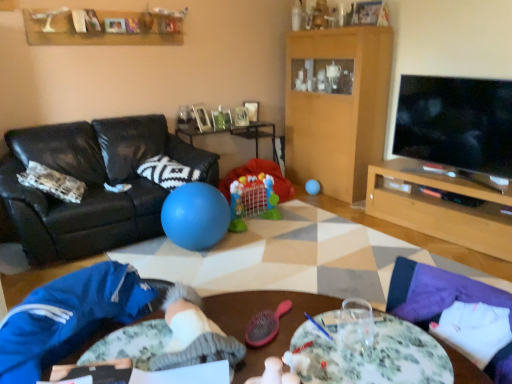
Question: Does wooden picture frame at upper center, the second picture frame in the left-to-right sequence, have a larger size compared to blue fleece pants at lower left?

Choices:
 (A) no
 (B) yes

Answer: (A)

Question: From the image's perspective, is wooden picture frame at upper center, the first picture frame positioned from the right, on top of blue fleece pants at lower left?

Choices:
 (A) no
 (B) yes

Answer: (B)

Question: Can you confirm if wooden picture frame at upper center, arranged as the second picture frame when viewed from the front, is shorter than blue fleece pants at lower left?

Choices:
 (A) yes
 (B) no

Answer: (A)

Question: From the image's perspective, is wooden picture frame at upper center, which is the first picture frame from back to front, below blue fleece pants at lower left?

Choices:
 (A) no
 (B) yes

Answer: (A)

Question: From a real-world perspective, is wooden picture frame at upper center, arranged as the second picture frame when viewed from the front, physically below blue fleece pants at lower left?

Choices:
 (A) yes
 (B) no

Answer: (B)

Question: Based on their sizes in the image, would you say smooth plastic ball at center, which is counted as the 1th table, starting from the left, is bigger or smaller than plastic colorful playpen at center?

Choices:
 (A) big
 (B) small

Answer: (A)

Question: Does point (192, 134) appear closer or farther from the camera than point (268, 160)?

Choices:
 (A) farther
 (B) closer

Answer: (B)

Question: In terms of height, does smooth plastic ball at center, which is counted as the 1th table, starting from the left, look taller or shorter compared to plastic colorful playpen at center?

Choices:
 (A) tall
 (B) short

Answer: (A)

Question: Is smooth plastic ball at center, which is the 2th table in front-to-back order, inside the boundaries of plastic colorful playpen at center, or outside?

Choices:
 (A) outside
 (B) inside

Answer: (A)

Question: In terms of height, does blue fleece pants at lower left look taller or shorter compared to smooth plastic ball at center, which is the 2th table in front-to-back order?

Choices:
 (A) tall
 (B) short

Answer: (B)

Question: In terms of width, does blue fleece pants at lower left look wider or thinner when compared to smooth plastic ball at center, the 2th table viewed from the right?

Choices:
 (A) thin
 (B) wide

Answer: (B)

Question: Would you say blue fleece pants at lower left is inside or outside smooth plastic ball at center, the 1th table positioned from the back?

Choices:
 (A) outside
 (B) inside

Answer: (A)

Question: Does point (35, 350) appear closer or farther from the camera than point (256, 142)?

Choices:
 (A) farther
 (B) closer

Answer: (B)

Question: In the image, is white knitted pillow at center on the left side or the right side of wooden picture frame at upper center, the first picture frame positioned from the right?

Choices:
 (A) left
 (B) right

Answer: (A)

Question: From the image's perspective, is white knitted pillow at center positioned above or below wooden picture frame at upper center, the first picture frame positioned from the right?

Choices:
 (A) below
 (B) above

Answer: (A)